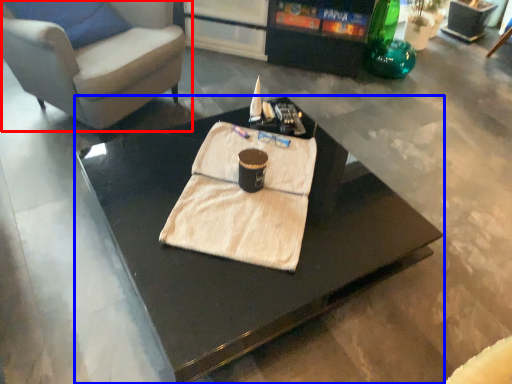
Question: Which of the following is the closest to the observer, chair (highlighted by a red box) or coffee table (highlighted by a blue box)?

Choices:
 (A) chair
 (B) coffee table

Answer: (B)